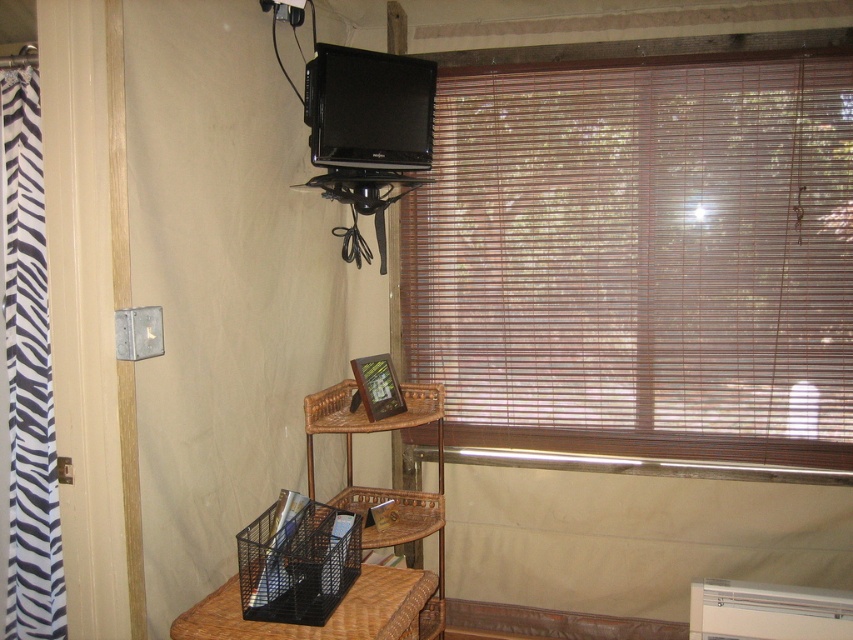
Is brown wood blinds at upper right shorter than white plastic air conditioner at lower right?

No, brown wood blinds at upper right is not shorter than white plastic air conditioner at lower right.

Between brown wood blinds at upper right and white plastic air conditioner at lower right, which one is positioned lower?

white plastic air conditioner at lower right is lower down.

The height and width of the screenshot is (640, 853). What do you see at coordinates (639, 259) in the screenshot?
I see `brown wood blinds at upper right` at bounding box center [639, 259].

This screenshot has width=853, height=640. What are the coordinates of `brown wood blinds at upper right` in the screenshot? It's located at (639, 259).

Identify the location of black mesh basket at lower center. This screenshot has height=640, width=853. (329, 616).

Who is more distant from viewer, (354, 604) or (827, 628)?

Point (827, 628)

Locate an element on the screen. The height and width of the screenshot is (640, 853). black mesh basket at lower center is located at coordinates (329, 616).

Is brown wood blinds at upper right wider than black glossy tv at upper center?

Yes, brown wood blinds at upper right is wider than black glossy tv at upper center.

Where is `brown wood blinds at upper right`? brown wood blinds at upper right is located at coordinates (639, 259).